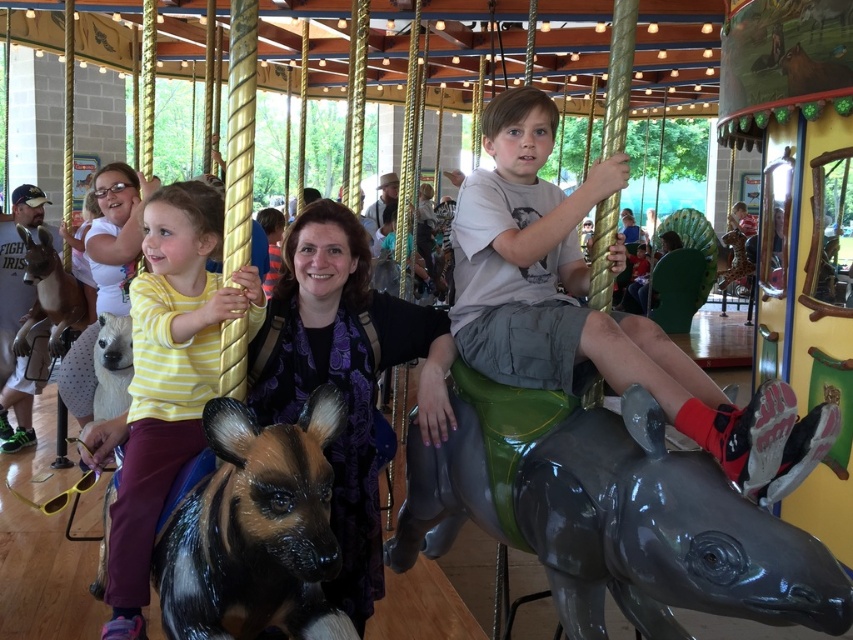
Question: Can you confirm if purple satin scarf at center is positioned below yellow striped shirt at left?

Choices:
 (A) yes
 (B) no

Answer: (A)

Question: Which object is closer to the camera taking this photo?

Choices:
 (A) matte gray shorts at center
 (B) shiny black horse at lower left
 (C) purple satin scarf at center
 (D) yellow striped shirt at left

Answer: (B)

Question: Among these points, which one is farthest from the camera?

Choices:
 (A) (519, 374)
 (B) (196, 301)
 (C) (347, 442)

Answer: (C)

Question: Is matte gray shorts at center smaller than purple satin scarf at center?

Choices:
 (A) yes
 (B) no

Answer: (B)

Question: Does shiny black horse at lower left appear over yellow striped shirt at left?

Choices:
 (A) yes
 (B) no

Answer: (B)

Question: Which object is closer to the camera taking this photo?

Choices:
 (A) yellow striped shirt at left
 (B) matte gray shorts at center
 (C) purple satin scarf at center
 (D) shiny black horse at lower left

Answer: (D)